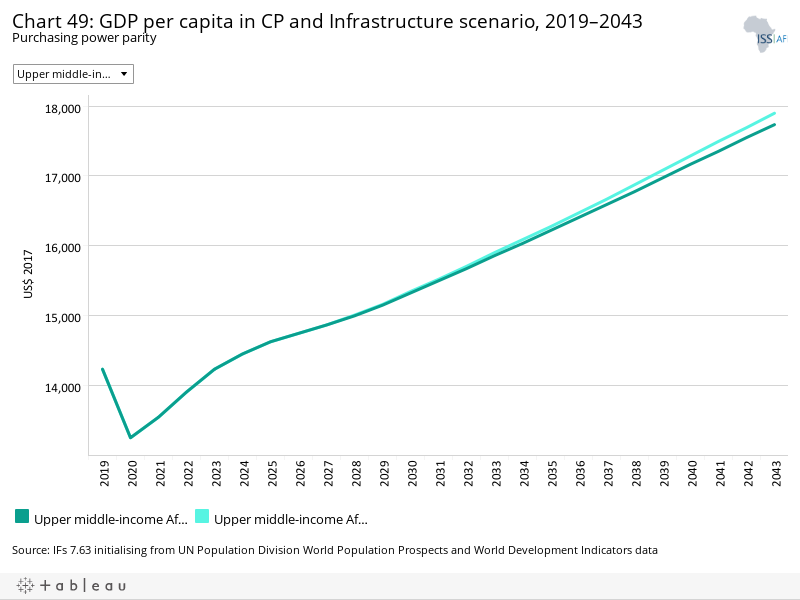
You are a GUI agent. You are given a task and a screenshot of the screen. Output one action in this format:
    pyautogui.click(x=<x>, y=<y>)
    Task: Click on the table
    The width and height of the screenshot is (800, 600).
    Given the screenshot: What is the action you would take?
    pyautogui.click(x=466, y=358)